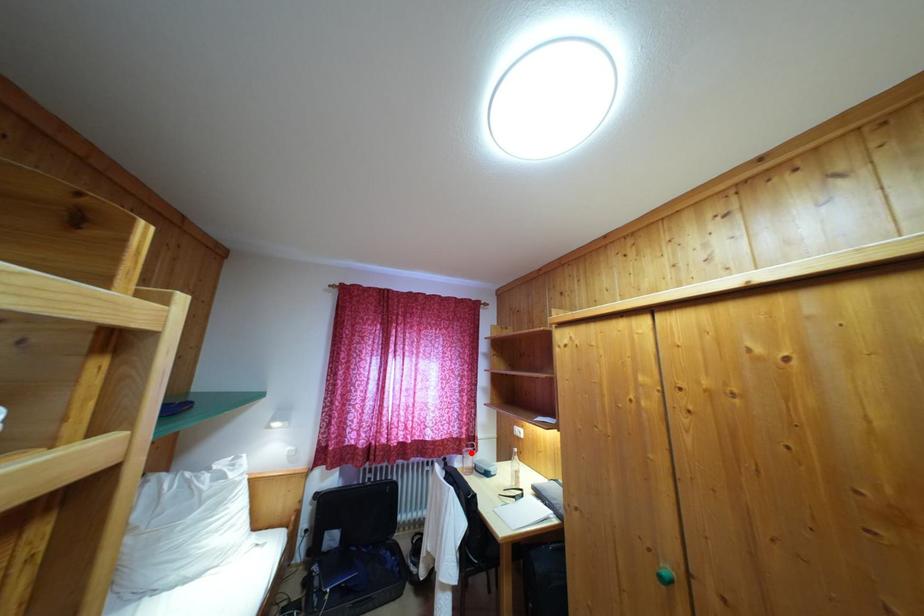
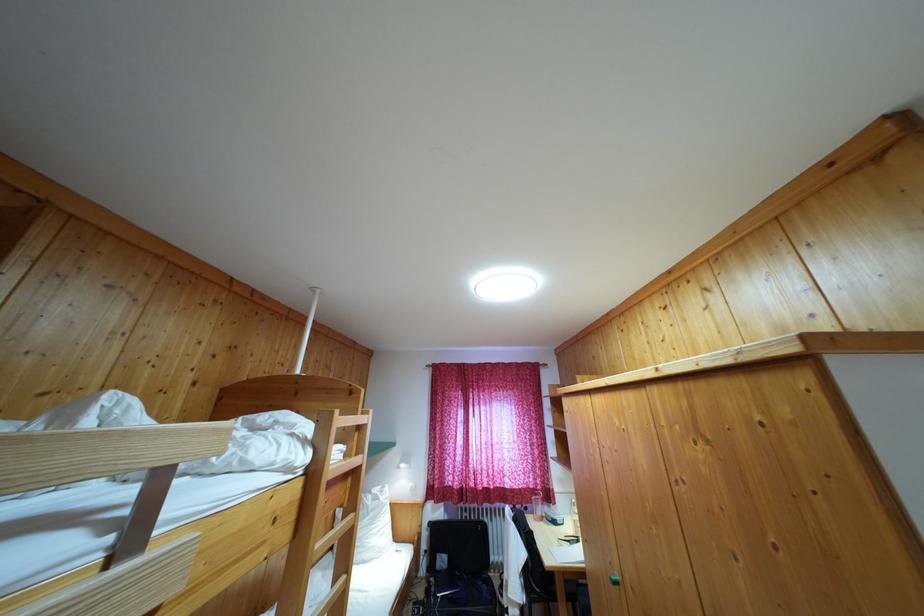
Where in the second image is the point corresponding to the highlighted location from the first image?

(539, 501)